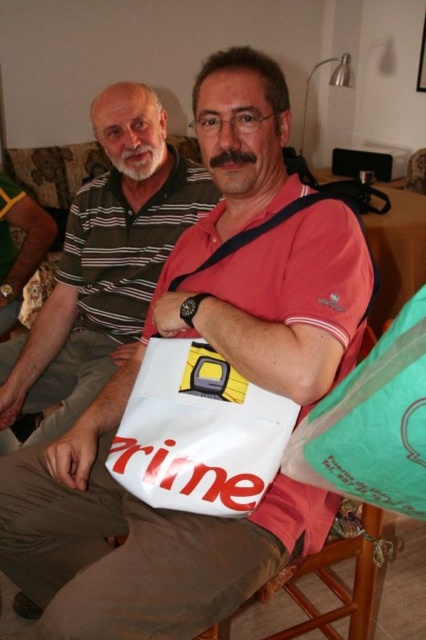
Question: Among these objects, which one is farthest from the camera?

Choices:
 (A) white matte bag at center
 (B) white matte tote at center
 (C) wooden chair at lower center

Answer: (A)

Question: Based on their relative distances, which object is farther from the white matte tote at center?

Choices:
 (A) white matte bag at center
 (B) green plastic bag at lower right
 (C) wooden chair at lower center

Answer: (A)

Question: Does white matte bag at center appear on the left side of green plastic bag at lower right?

Choices:
 (A) no
 (B) yes

Answer: (B)

Question: Does white matte bag at center have a greater width compared to wooden chair at lower center?

Choices:
 (A) yes
 (B) no

Answer: (A)

Question: Which of the following is the farthest from the observer?

Choices:
 (A) white matte tote at center
 (B) wooden chair at lower center
 (C) white matte bag at center
 (D) green plastic bag at lower right

Answer: (C)

Question: Is the position of white matte bag at center more distant than that of wooden chair at lower center?

Choices:
 (A) yes
 (B) no

Answer: (A)